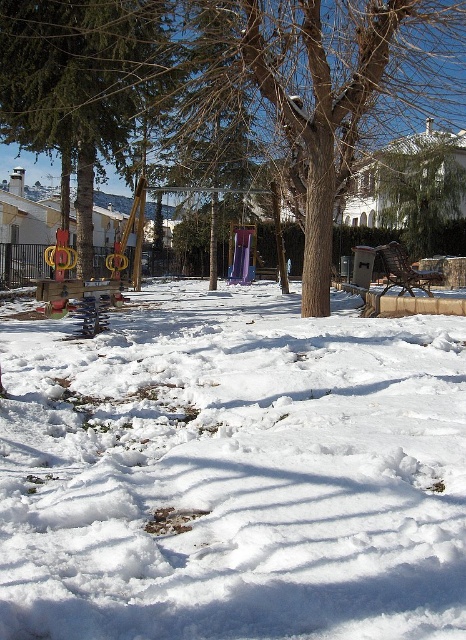
Question: Can you confirm if white fluffy snow at center is positioned above brown wood tree at center?

Choices:
 (A) yes
 (B) no

Answer: (B)

Question: Which object appears farthest from the camera in this image?

Choices:
 (A) brown wood tree at center
 (B) green matte tree at upper left

Answer: (B)

Question: Which object is farther from the camera taking this photo?

Choices:
 (A) green matte tree at upper left
 (B) white fluffy snow at center

Answer: (A)

Question: Is white fluffy snow at center above green matte tree at upper left?

Choices:
 (A) yes
 (B) no

Answer: (B)

Question: Which of the following is the farthest from the observer?

Choices:
 (A) brown wood tree at center
 (B) white fluffy snow at center
 (C) green matte tree at upper left

Answer: (C)

Question: Does white fluffy snow at center have a smaller size compared to green matte tree at upper left?

Choices:
 (A) yes
 (B) no

Answer: (B)